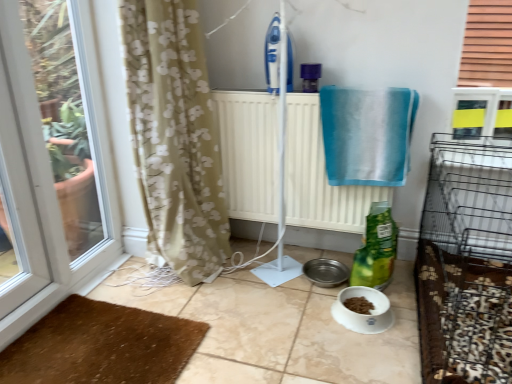
At what (x,y) coordinates should I click in order to perform the action: click on free space in front of green matte bag at lower center. Please return your answer as a coordinate pair (x, y). The height and width of the screenshot is (384, 512). Looking at the image, I should click on (399, 309).